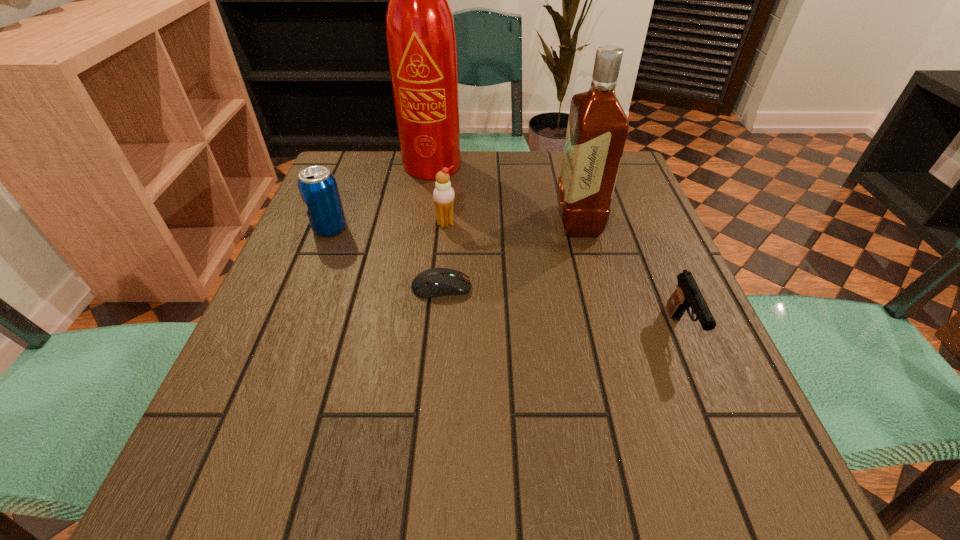
Where is `the tallest object`? the tallest object is located at coordinates (421, 40).

You are a GUI agent. You are given a task and a screenshot of the screen. Output one action in this format:
    pyautogui.click(x=<x>, y=<y>)
    Task: Click on the fire extinguisher
    Image resolution: width=960 pixels, height=540 pixels.
    Given the screenshot: What is the action you would take?
    pyautogui.click(x=421, y=40)

The height and width of the screenshot is (540, 960). Identify the location of the second tallest object. (597, 128).

Identify the location of the second object from right to left. (597, 128).

This screenshot has height=540, width=960. In order to click on icecream in this screenshot , I will do `click(443, 195)`.

Identify the location of pop soda. (317, 185).

Locate an element on the screen. Image resolution: width=960 pixels, height=540 pixels. the nearest object is located at coordinates (687, 294).

This screenshot has width=960, height=540. I want to click on pistol, so click(687, 294).

This screenshot has width=960, height=540. In order to click on computer equipment in this screenshot , I will do `click(434, 282)`.

Identify the location of the second nearest object. (434, 282).